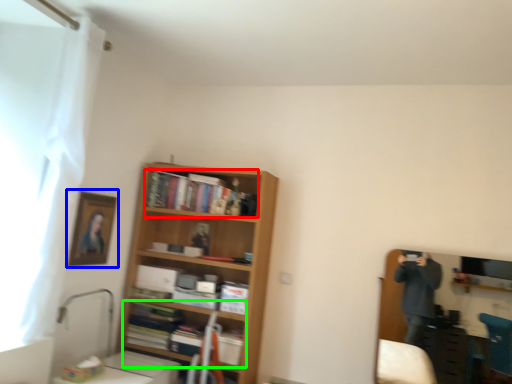
Question: Which object is positioned farthest from book (highlighted by a red box)? Select from picture frame (highlighted by a blue box) and book (highlighted by a green box).

Choices:
 (A) picture frame
 (B) book

Answer: (B)